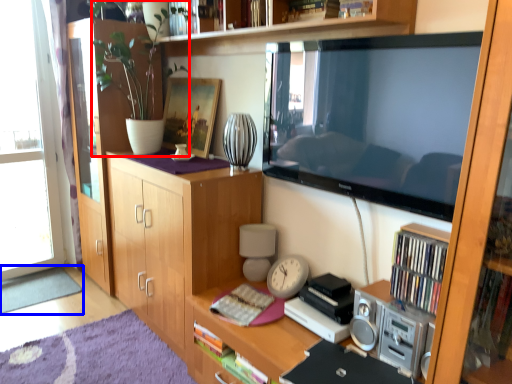
Question: Which of the following is the closest to the observer, houseplant (highlighted by a red box) or plain (highlighted by a blue box)?

Choices:
 (A) houseplant
 (B) plain

Answer: (A)